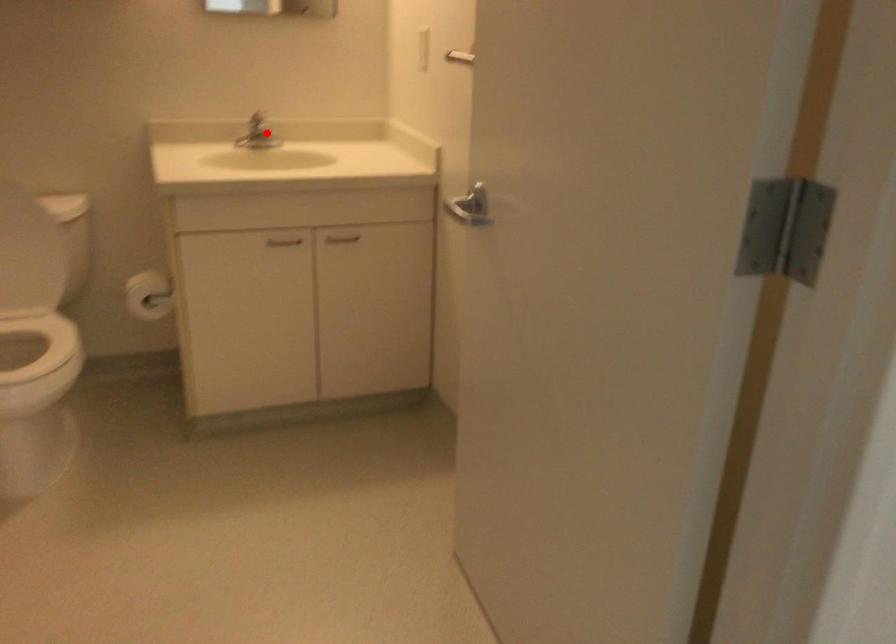
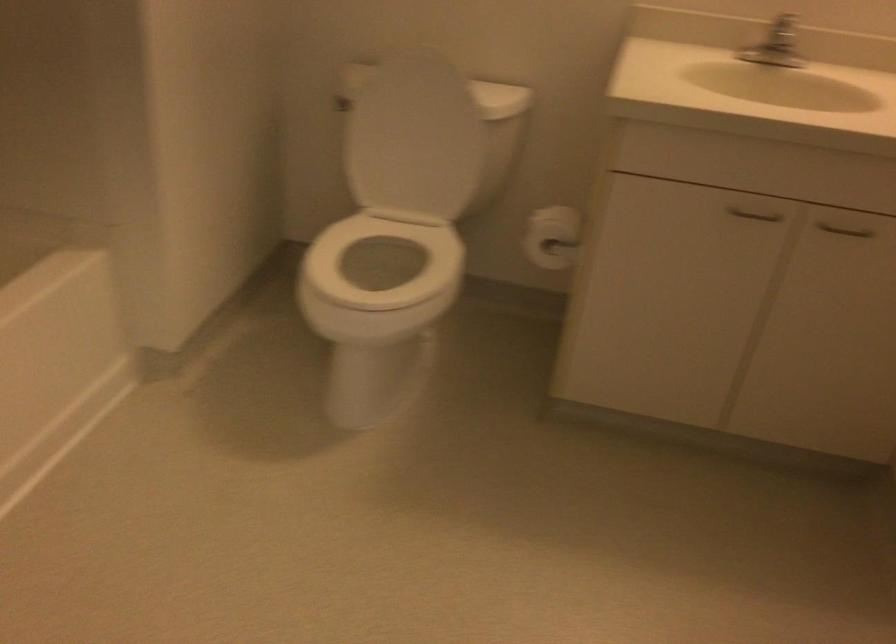
Question: I am providing you with two images of the same scene from different viewpoints. Given a red point in image1, look at the same physical point in image2. Is it:

Choices:
 (A) Closer to the viewpoint
 (B) Farther from the viewpoint

Answer: (A)